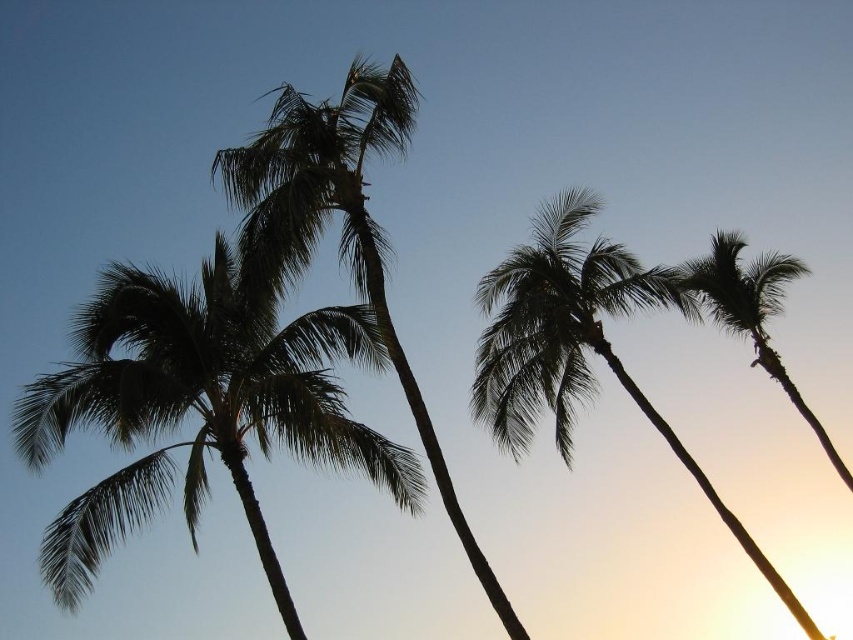
Question: Considering the real-world distances, which object is closest to the silhouette leafy palm at right?

Choices:
 (A) silhouette leafy palm at left
 (B) silhouette leafy palm at center
 (C) silhouette leafy palm at upper center

Answer: (C)

Question: Which object is closer to the camera taking this photo?

Choices:
 (A) silhouette leafy palm at upper center
 (B) silhouette leafy palm at right
 (C) silhouette leafy palm at left
 (D) silhouette leafy palm at center

Answer: (D)

Question: Does silhouette leafy palm at left come behind silhouette leafy palm at center?

Choices:
 (A) yes
 (B) no

Answer: (A)

Question: Can you confirm if silhouette leafy palm at upper center is positioned above silhouette leafy palm at center?

Choices:
 (A) yes
 (B) no

Answer: (B)

Question: Can you confirm if silhouette leafy palm at left is positioned above silhouette leafy palm at right?

Choices:
 (A) yes
 (B) no

Answer: (B)

Question: Which object is the farthest from the silhouette leafy palm at left?

Choices:
 (A) silhouette leafy palm at center
 (B) silhouette leafy palm at right

Answer: (B)